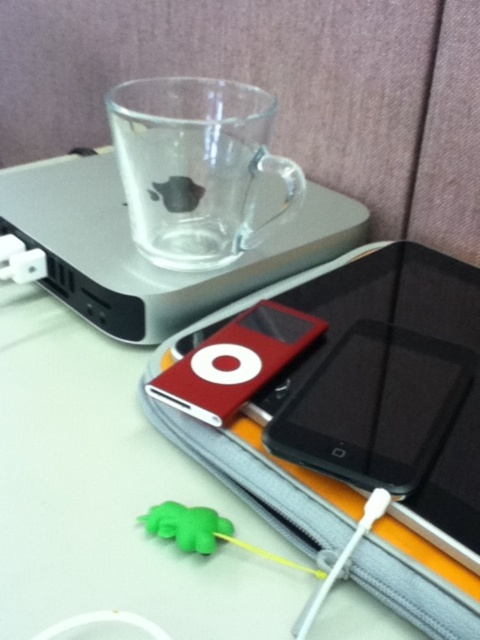
You are organizing your desk and need to place a new item between the transparent plastic ipod at center and the black glossy iphone at center. The item is 10 inches long. Will there be enough space between them to fit it?

The transparent plastic ipod at center is 12.55 inches away from the black glossy iphone at center. Since the new item is 10 inches long, there is sufficient space between them to fit it.

You are organizing your desk and need to place a new item between the black glossy iPhone at center and the transparent glass mug on the laptop. Can you determine the direction you should move the iPhone to make space?

The black glossy iPhone at center is located at point [375,406]. Since the mug is on the laptop in the background, moving the iPhone slightly forward would create space between them.